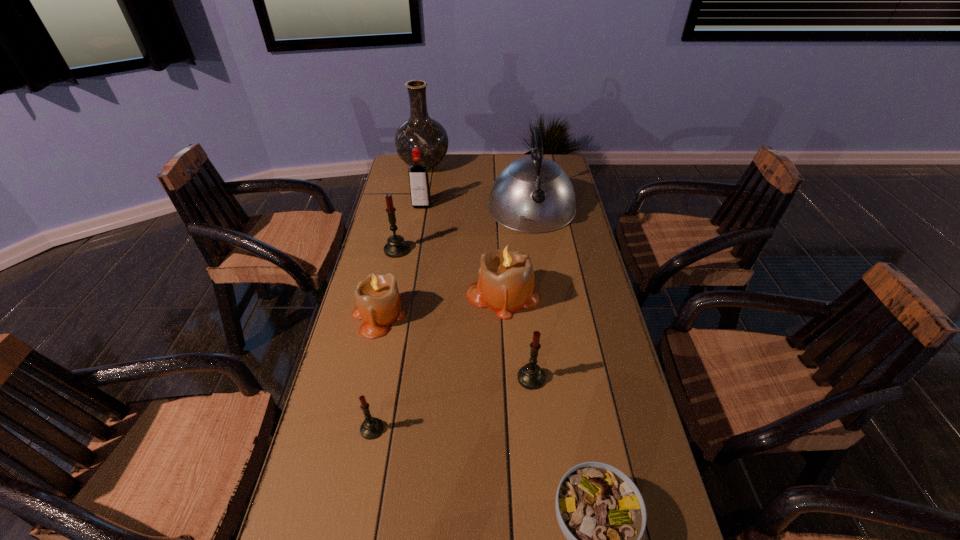
The width and height of the screenshot is (960, 540). In order to click on the farthest object in this screenshot , I will do `click(420, 131)`.

Image resolution: width=960 pixels, height=540 pixels. In order to click on kettle in this screenshot , I will do `click(533, 194)`.

You are a GUI agent. You are given a task and a screenshot of the screen. Output one action in this format:
    pyautogui.click(x=<x>, y=<y>)
    Task: Click on the red vodka
    The height and width of the screenshot is (540, 960).
    Given the screenshot: What is the action you would take?
    pyautogui.click(x=418, y=175)

Locate an element on the screen. The width and height of the screenshot is (960, 540). the farthest red candle is located at coordinates (396, 247).

The image size is (960, 540). What are the coordinates of `the sixth nearest object` in the screenshot? It's located at (396, 247).

Image resolution: width=960 pixels, height=540 pixels. I want to click on the bigger beige candle, so click(x=505, y=284).

This screenshot has width=960, height=540. Find the location of `the fourth farthest candle`. the fourth farthest candle is located at coordinates (531, 376).

Locate an element on the screen. The image size is (960, 540). the second nearest red candle is located at coordinates (531, 376).

The image size is (960, 540). I want to click on the smaller beige candle, so click(378, 301).

This screenshot has height=540, width=960. What are the coordinates of `the nearest red candle` in the screenshot? It's located at (371, 428).